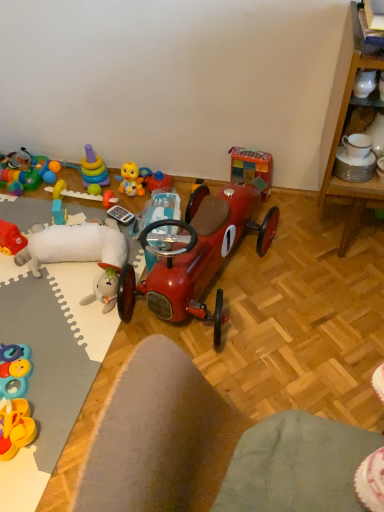
Locate an element on the screen. The height and width of the screenshot is (512, 384). vacant space situated on the left part of rubberized green ball at center, the fifth toy positioned from the right is located at coordinates (52, 201).